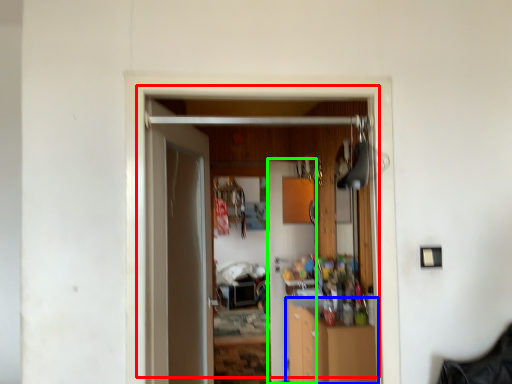
Question: Which object is the farthest from door (highlighted by a red box)? Choose among these: cabinetry (highlighted by a blue box) or door (highlighted by a green box).

Choices:
 (A) cabinetry
 (B) door

Answer: (B)